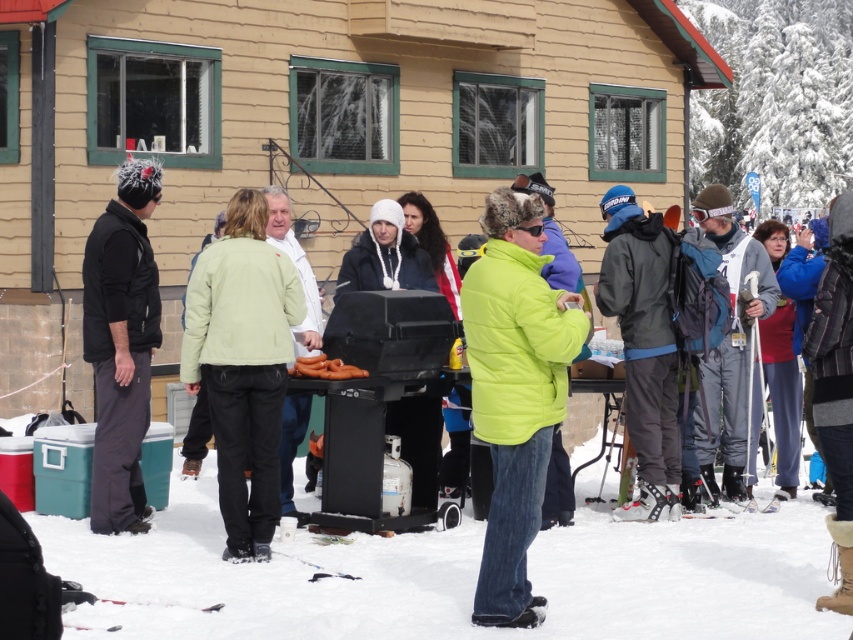
Does green puffy jacket at center have a greater height compared to brown matte hot dogs at center?

Indeed, green puffy jacket at center has a greater height compared to brown matte hot dogs at center.

Between point (566, 352) and point (318, 371), which one is positioned in front?

Point (566, 352) is more forward.

The height and width of the screenshot is (640, 853). What are the coordinates of `green puffy jacket at center` in the screenshot? It's located at (515, 392).

Is white fluffy snow at lower center thinner than brown matte hot dogs at center?

Yes, white fluffy snow at lower center is thinner than brown matte hot dogs at center.

Who is more forward, (370, 605) or (329, 371)?

Point (370, 605) is more forward.

Find the location of a particular element. The height and width of the screenshot is (640, 853). white fluffy snow at lower center is located at coordinates (451, 577).

From the picture: Can you confirm if light green fabric jacket at center is thinner than black fleece jacket at left?

Incorrect, light green fabric jacket at center's width is not less than black fleece jacket at left's.

Which of these two, light green fabric jacket at center or black fleece jacket at left, stands taller?

black fleece jacket at left

Identify the location of light green fabric jacket at center. The image size is (853, 640). (242, 365).